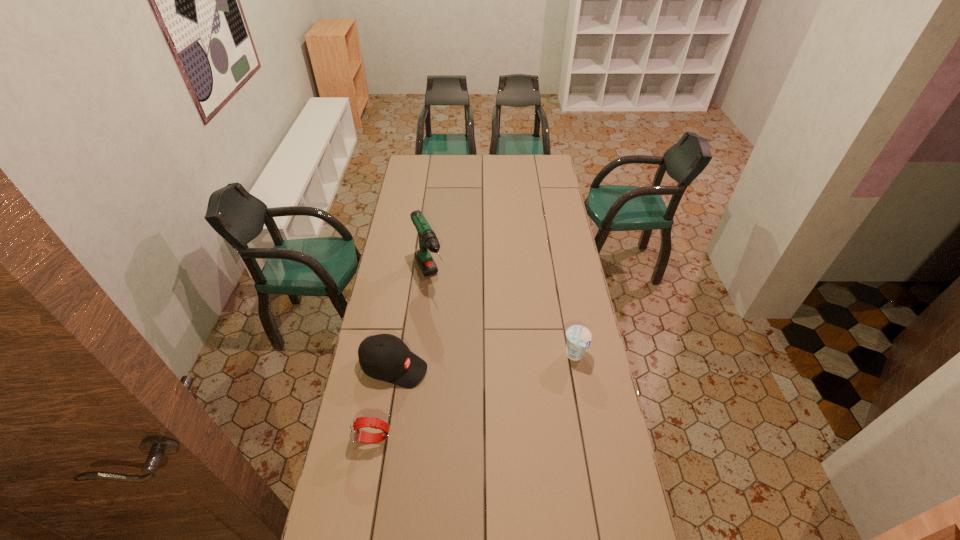
What are the coordinates of `blank space located on the handle side of the drill` in the screenshot? It's located at (447, 326).

Where is `free space located on the handle side of the drill`? This screenshot has height=540, width=960. free space located on the handle side of the drill is located at coordinates (446, 324).

Image resolution: width=960 pixels, height=540 pixels. What are the coordinates of `watch located at the left edge` in the screenshot? It's located at (356, 434).

Where is `baseball cap at the left edge`? baseball cap at the left edge is located at coordinates point(385,357).

This screenshot has width=960, height=540. I want to click on drill present at the left edge, so click(427, 238).

In order to click on object that is at the right edge in this screenshot , I will do `click(579, 337)`.

At what (x,y) coordinates should I click in order to perform the action: click on free region at the far edge of the desktop. Please return your answer as a coordinate pair (x, y). Looking at the image, I should click on click(x=516, y=161).

This screenshot has width=960, height=540. I want to click on blank space at the near edge of the desktop, so click(x=577, y=515).

In order to click on free location at the left edge in this screenshot , I will do `click(406, 225)`.

Find the location of a particular element. The height and width of the screenshot is (540, 960). free spot at the right edge of the desktop is located at coordinates (576, 492).